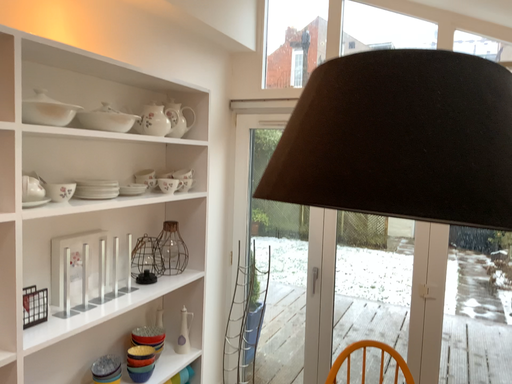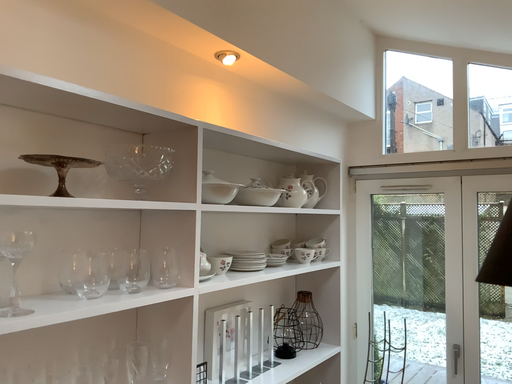
Question: Which way did the camera rotate in the video?

Choices:
 (A) rotated right
 (B) rotated left

Answer: (B)